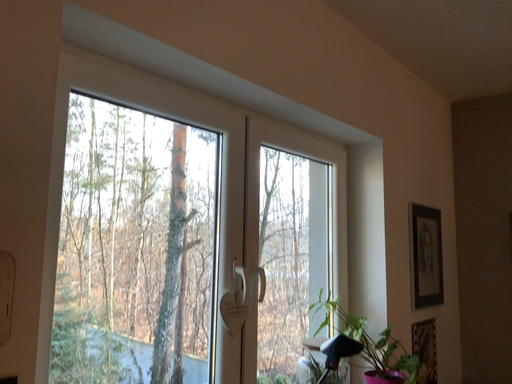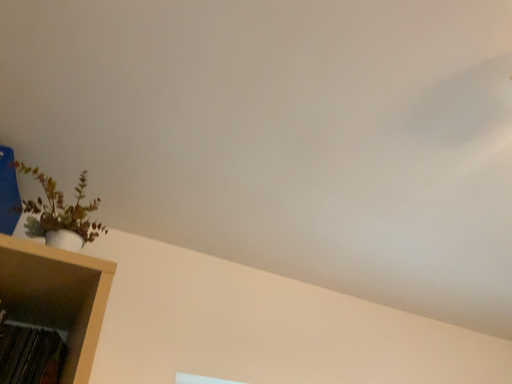
Question: How did the camera likely rotate when shooting the video?

Choices:
 (A) rotated downward
 (B) rotated upward

Answer: (B)